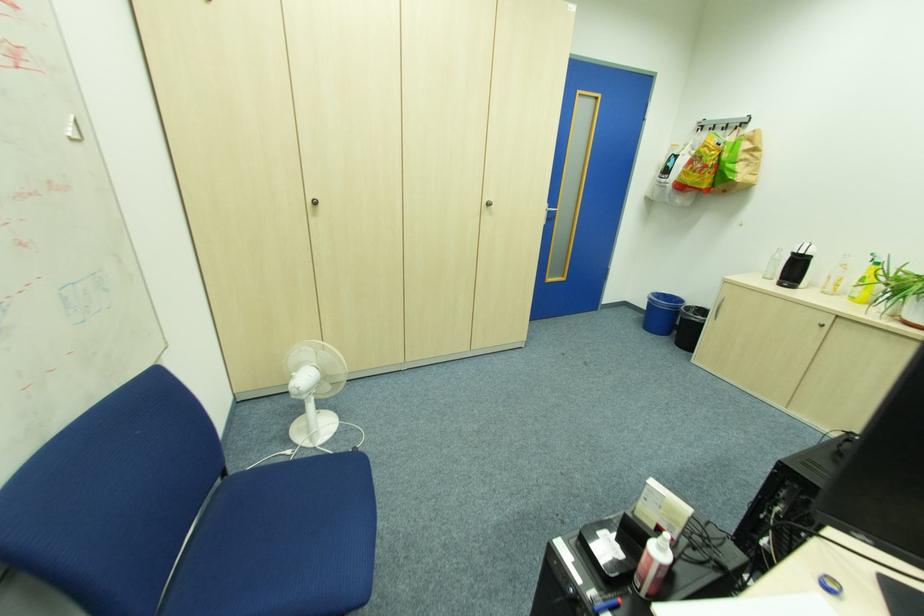
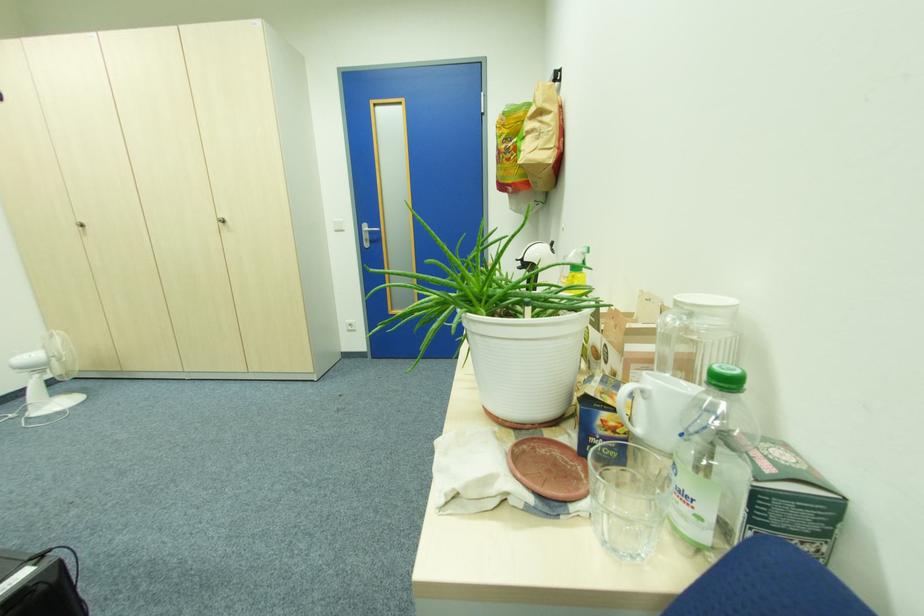
Which direction would the cameraman need to move to produce the second image?

The movement direction of the cameraman is right, forward.